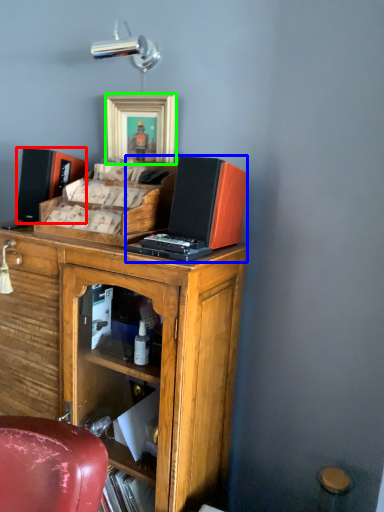
Question: Which is farther away from speaker (highlighted by a red box)? computer (highlighted by a blue box) or picture frame (highlighted by a green box)?

Choices:
 (A) computer
 (B) picture frame

Answer: (A)